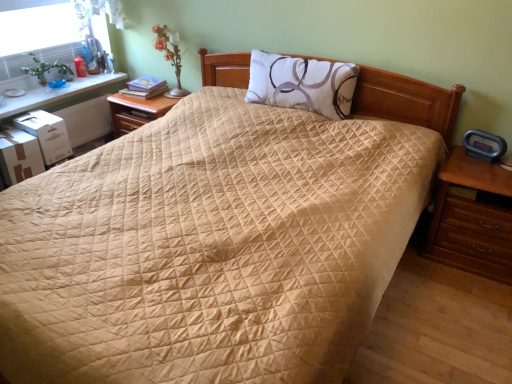
Locate an element on the screen. This screenshot has height=384, width=512. white glossy table at upper left is located at coordinates (56, 93).

The image size is (512, 384). What do you see at coordinates (472, 219) in the screenshot? I see `brown wooden nightstand at right, arranged as the 2th nightstand when viewed from the back` at bounding box center [472, 219].

I want to click on wooden nightstand at center-left, positioned as the 1th nightstand in left-to-right order, so click(x=137, y=111).

In the scene shown: From the image's perspective, which object appears higher, brown wooden nightstand at right, arranged as the first nightstand when viewed from the front, or matte white glass table lamp at upper left?

From the image's view, matte white glass table lamp at upper left is above.

From a real-world perspective, is brown wooden nightstand at right, the first nightstand when ordered from bottom to top, physically above matte white glass table lamp at upper left?

No.

Is brown wooden nightstand at right, arranged as the 2th nightstand when viewed from the back, surrounding matte white glass table lamp at upper left?

No.

How different are the orientations of brown wooden nightstand at right, which ranks as the 2th nightstand in left-to-right order, and matte white glass table lamp at upper left in degrees?

The angular difference between brown wooden nightstand at right, which ranks as the 2th nightstand in left-to-right order, and matte white glass table lamp at upper left is 0.311 degrees.

How distant is wooden nightstand at center-left, which ranks as the second nightstand in right-to-left order, from white matte pillow at center?

93.29 centimeters.

Locate an element on the screen. The height and width of the screenshot is (384, 512). pillow positioned vertically above the wooden nightstand at center-left, the second nightstand when ordered from front to back (from a real-world perspective) is located at coordinates pyautogui.click(x=302, y=84).

Is wooden nightstand at center-left, which ranks as the second nightstand in right-to-left order, wider or thinner than white matte pillow at center?

Considering their sizes, wooden nightstand at center-left, which ranks as the second nightstand in right-to-left order, looks broader than white matte pillow at center.

Is wooden nightstand at center-left, placed as the 1th nightstand when sorted from top to bottom, aimed at white matte pillow at center?

No, wooden nightstand at center-left, placed as the 1th nightstand when sorted from top to bottom, is not facing towards white matte pillow at center.

Where is `nightstand in front of the white matte pillow at center`? This screenshot has width=512, height=384. nightstand in front of the white matte pillow at center is located at coordinates (472, 219).

Is the position of brown wooden nightstand at right, arranged as the 2th nightstand when viewed from the top, more distant than that of white matte pillow at center?

No, it is not.

Is brown wooden nightstand at right, arranged as the 2th nightstand when viewed from the back, beside white matte pillow at center?

They are not placed beside each other.

Which object is closer to the camera taking this photo, brown wooden nightstand at right, arranged as the 2th nightstand when viewed from the back, or wooden nightstand at center-left, which ranks as the second nightstand in right-to-left order?

brown wooden nightstand at right, arranged as the 2th nightstand when viewed from the back, is closer to the camera.

How distant is brown wooden nightstand at right, which appears as the 1th nightstand when viewed from the right, from wooden nightstand at center-left, placed as the 1th nightstand when sorted from top to bottom?

A distance of 6.53 feet exists between brown wooden nightstand at right, which appears as the 1th nightstand when viewed from the right, and wooden nightstand at center-left, placed as the 1th nightstand when sorted from top to bottom.

Is brown wooden nightstand at right, arranged as the 2th nightstand when viewed from the top, taller or shorter than wooden nightstand at center-left, which ranks as the second nightstand in right-to-left order?

Clearly, brown wooden nightstand at right, arranged as the 2th nightstand when viewed from the top, is taller compared to wooden nightstand at center-left, which ranks as the second nightstand in right-to-left order.

Is brown wooden nightstand at right, the first nightstand when ordered from bottom to top, facing towards wooden nightstand at center-left, which ranks as the second nightstand in right-to-left order?

No, brown wooden nightstand at right, the first nightstand when ordered from bottom to top, is not turned towards wooden nightstand at center-left, which ranks as the second nightstand in right-to-left order.

Between white glossy table at upper left and brown wooden nightstand at right, arranged as the first nightstand when viewed from the front, which one is positioned in front?

brown wooden nightstand at right, arranged as the first nightstand when viewed from the front, is in front.

Is there a large distance between white glossy table at upper left and brown wooden nightstand at right, the first nightstand when ordered from bottom to top?

Yes.

Is white glossy table at upper left looking in the opposite direction of brown wooden nightstand at right, which ranks as the 2th nightstand in left-to-right order?

No, white glossy table at upper left is not facing the opposite direction of brown wooden nightstand at right, which ranks as the 2th nightstand in left-to-right order.

From the image's perspective, would you say white glossy table at upper left is shown under brown wooden nightstand at right, which ranks as the 2th nightstand in left-to-right order?

No, from the image's perspective, white glossy table at upper left is not below brown wooden nightstand at right, which ranks as the 2th nightstand in left-to-right order.

In terms of width, does wooden nightstand at center-left, placed as the 1th nightstand when sorted from top to bottom, look wider or thinner when compared to brown wooden nightstand at right, arranged as the 2th nightstand when viewed from the top?

wooden nightstand at center-left, placed as the 1th nightstand when sorted from top to bottom, is wider than brown wooden nightstand at right, arranged as the 2th nightstand when viewed from the top.

Considering their positions, is wooden nightstand at center-left, placed as the 1th nightstand when sorted from top to bottom, located in front of or behind brown wooden nightstand at right, which ranks as the 2th nightstand in left-to-right order?

wooden nightstand at center-left, placed as the 1th nightstand when sorted from top to bottom, is behind brown wooden nightstand at right, which ranks as the 2th nightstand in left-to-right order.

From the image's perspective, who appears lower, wooden nightstand at center-left, positioned as the 1th nightstand in left-to-right order, or brown wooden nightstand at right, which ranks as the 2th nightstand in left-to-right order?

brown wooden nightstand at right, which ranks as the 2th nightstand in left-to-right order, is shown below in the image.

In terms of size, does wooden nightstand at center-left, which is the second nightstand from bottom to top, appear bigger or smaller than brown wooden nightstand at right, the first nightstand when ordered from bottom to top?

Clearly, wooden nightstand at center-left, which is the second nightstand from bottom to top, is smaller in size than brown wooden nightstand at right, the first nightstand when ordered from bottom to top.

In terms of size, does white matte pillow at center appear bigger or smaller than white glossy table at upper left?

In the image, white matte pillow at center appears to be larger than white glossy table at upper left.

This screenshot has width=512, height=384. In order to click on pillow on the right of the white glossy table at upper left in this screenshot , I will do `click(302, 84)`.

From the image's perspective, relative to white glossy table at upper left, is white matte pillow at center above or below?

Based on their image positions, white matte pillow at center is located beneath white glossy table at upper left.

From the picture: Which of these two, white matte pillow at center or white glossy table at upper left, is thinner?

Thinner between the two is white matte pillow at center.

From a real-world perspective, which nightstand is the 2nd one underneath the matte white glass table lamp at upper left? Please provide its 2D coordinates.

[(472, 219)]

Locate an element on the screen. The height and width of the screenshot is (384, 512). pillow that is above the wooden nightstand at center-left, which is the second nightstand from bottom to top (from the image's perspective) is located at coordinates (302, 84).

From the image, which object appears to be farther from white matte pillow at center, brown wooden nightstand at right, arranged as the first nightstand when viewed from the front, or matte white glass table lamp at upper left?

matte white glass table lamp at upper left is positioned further to the anchor white matte pillow at center.

From the image, which object appears to be nearer to white glossy table at upper left, brown wooden nightstand at right, arranged as the 2th nightstand when viewed from the back, or matte white glass table lamp at upper left?

Based on the image, matte white glass table lamp at upper left appears to be nearer to white glossy table at upper left.

Based on the photo, which object lies nearer to the anchor point wooden nightstand at center-left, positioned as the 1th nightstand in left-to-right order, matte white glass table lamp at upper left or brown wooden nightstand at right, which appears as the 1th nightstand when viewed from the right?

Based on the image, matte white glass table lamp at upper left appears to be nearer to wooden nightstand at center-left, positioned as the 1th nightstand in left-to-right order.

From the picture: Based on their spatial positions, is wooden nightstand at center-left, which ranks as the first nightstand in back-to-front order, or white matte pillow at center further from white glossy table at upper left?

Among the two, white matte pillow at center is located further to white glossy table at upper left.

Based on their spatial positions, is wooden nightstand at center-left, which ranks as the second nightstand in right-to-left order, or matte white glass table lamp at upper left closer to white glossy table at upper left?

Based on the image, wooden nightstand at center-left, which ranks as the second nightstand in right-to-left order, appears to be nearer to white glossy table at upper left.

Based on their spatial positions, is wooden nightstand at center-left, which ranks as the first nightstand in back-to-front order, or matte white glass table lamp at upper left further from brown wooden nightstand at right, the first nightstand when ordered from bottom to top?

matte white glass table lamp at upper left is further to brown wooden nightstand at right, the first nightstand when ordered from bottom to top.

From the image, which object appears to be farther from brown wooden nightstand at right, arranged as the 2th nightstand when viewed from the top, white matte pillow at center or wooden nightstand at center-left, the second nightstand when ordered from front to back?

Among the two, wooden nightstand at center-left, the second nightstand when ordered from front to back, is located further to brown wooden nightstand at right, arranged as the 2th nightstand when viewed from the top.

When comparing their distances from matte white glass table lamp at upper left, does white glossy table at upper left or white matte pillow at center seem further?

white matte pillow at center.

Identify the location of nightstand located between white glossy table at upper left and white matte pillow at center in the left-right direction. The height and width of the screenshot is (384, 512). (137, 111).

Where is `table lamp between white glossy table at upper left and brown wooden nightstand at right, arranged as the first nightstand when viewed from the front`? This screenshot has width=512, height=384. table lamp between white glossy table at upper left and brown wooden nightstand at right, arranged as the first nightstand when viewed from the front is located at coordinates [x=170, y=55].

Locate an element on the screen. table lamp located between wooden nightstand at center-left, which is the second nightstand from bottom to top, and brown wooden nightstand at right, which ranks as the 2th nightstand in left-to-right order, in the left-right direction is located at coordinates (170, 55).

Image resolution: width=512 pixels, height=384 pixels. I want to click on pillow located between wooden nightstand at center-left, the second nightstand when ordered from front to back, and brown wooden nightstand at right, arranged as the first nightstand when viewed from the front, in the left-right direction, so click(302, 84).